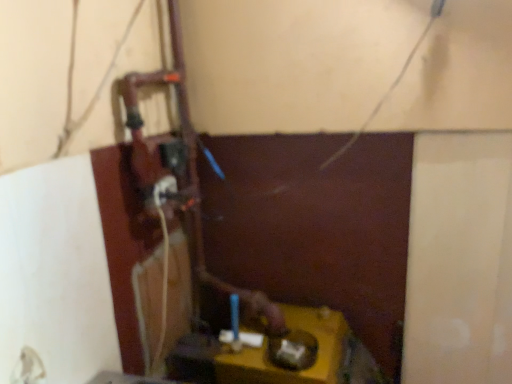
Question: Looking at the image, does yellow matte table at lower center seem bigger or smaller compared to white plastic power plugs and sockets at center-left?

Choices:
 (A) small
 (B) big

Answer: (B)

Question: From their relative heights in the image, would you say yellow matte table at lower center is taller or shorter than white plastic power plugs and sockets at center-left?

Choices:
 (A) short
 (B) tall

Answer: (B)

Question: Would you say yellow matte table at lower center is to the left or to the right of white plastic power plugs and sockets at center-left in the picture?

Choices:
 (A) left
 (B) right

Answer: (B)

Question: Considering their positions, is white plastic power plugs and sockets at center-left located in front of or behind yellow matte table at lower center?

Choices:
 (A) behind
 (B) front

Answer: (A)

Question: Looking at their shapes, would you say white plastic power plugs and sockets at center-left is wider or thinner than yellow matte table at lower center?

Choices:
 (A) wide
 (B) thin

Answer: (B)

Question: From a real-world perspective, is white plastic power plugs and sockets at center-left above or below yellow matte table at lower center?

Choices:
 (A) above
 (B) below

Answer: (A)

Question: Visually, is white plastic power plugs and sockets at center-left positioned to the left or to the right of yellow matte table at lower center?

Choices:
 (A) left
 (B) right

Answer: (A)